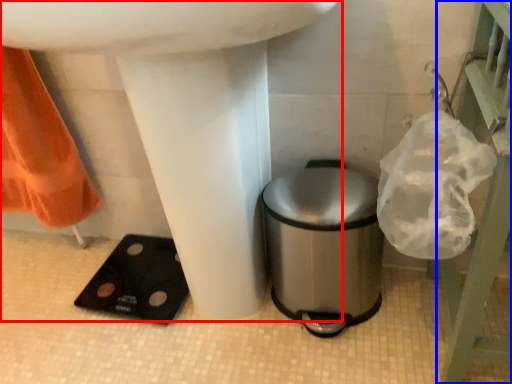
Question: Which point is closer to the camera, sink (highlighted by a red box) or balustrade (highlighted by a blue box)?

Choices:
 (A) sink
 (B) balustrade

Answer: (A)